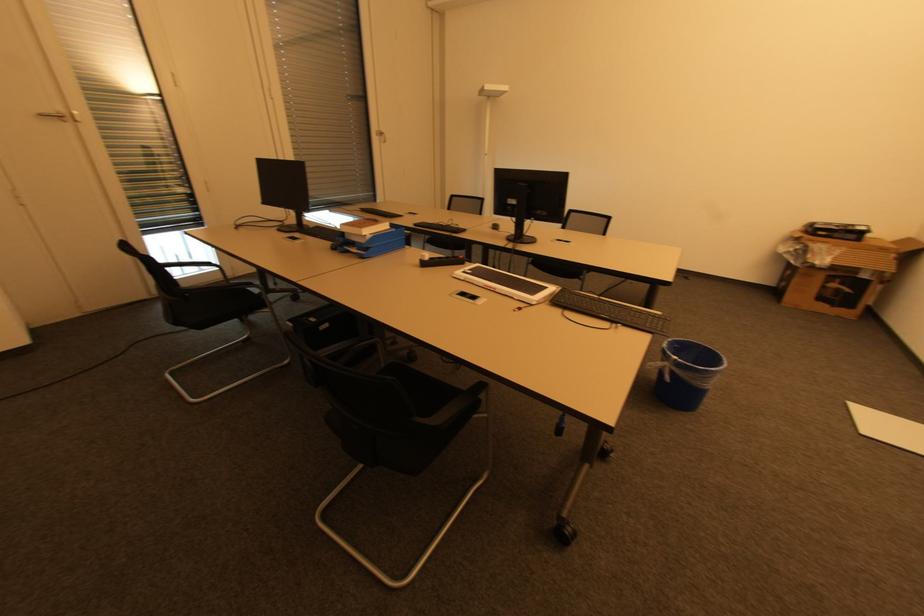
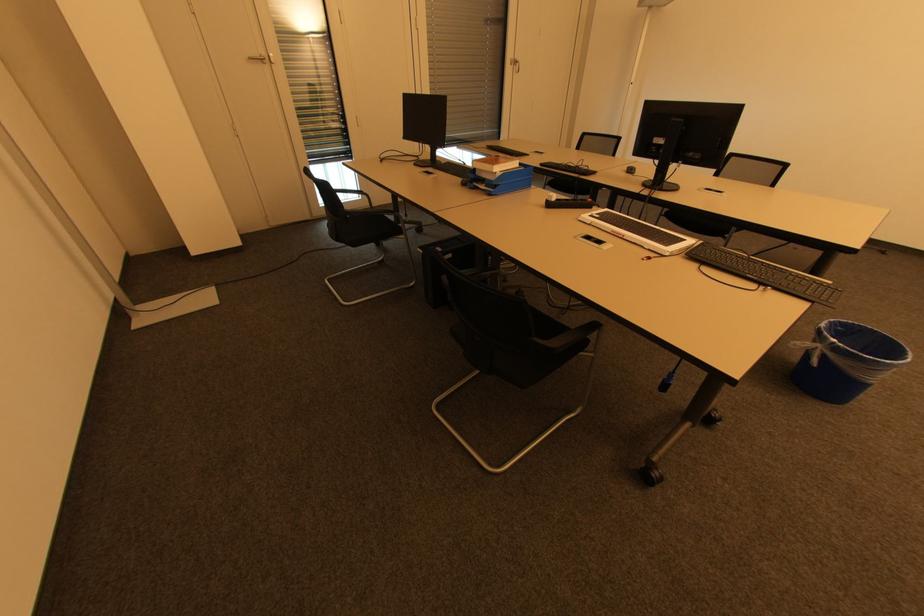
In the second image, find the point that corresponds to [426,265] in the first image.

(551, 206)